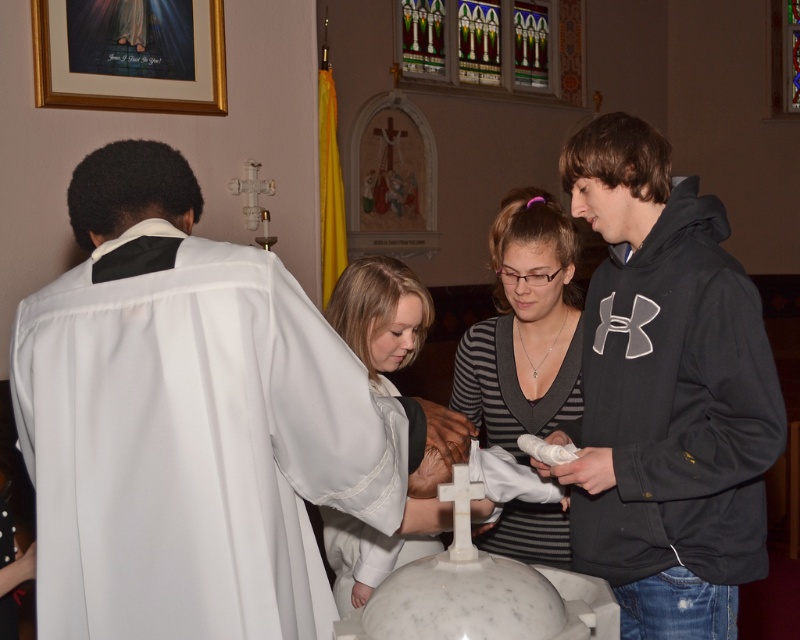
Question: Which point appears closest to the camera in this image?

Choices:
 (A) (312, 573)
 (B) (350, 524)

Answer: (A)

Question: Considering the relative positions of black hoodie at center and striped jersey at center in the image provided, where is black hoodie at center located with respect to striped jersey at center?

Choices:
 (A) right
 (B) left

Answer: (A)

Question: Is striped jersey at center thinner than white satin robe at center?

Choices:
 (A) yes
 (B) no

Answer: (B)

Question: Can you confirm if white silk robe at left is positioned to the right of white matte cross at center?

Choices:
 (A) yes
 (B) no

Answer: (B)

Question: Which object is closer to the camera taking this photo?

Choices:
 (A) black hoodie at center
 (B) white matte cross at center
 (C) white silk robe at left

Answer: (C)

Question: Which of the following is the closest to the observer?

Choices:
 (A) black hoodie at center
 (B) white satin robe at center

Answer: (A)